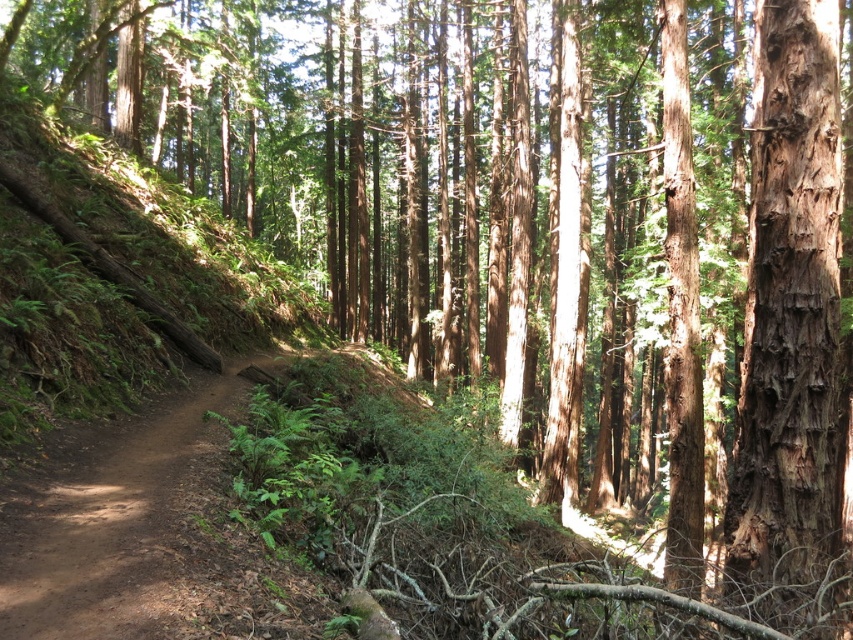
Question: In this image, where is rough bark tree trunk at right located relative to brown dirt track at center?

Choices:
 (A) above
 (B) below

Answer: (A)

Question: Which object is closer to the camera taking this photo?

Choices:
 (A) rough bark tree trunk at right
 (B) brown dirt track at center

Answer: (A)

Question: Is rough bark tree trunk at right thinner than brown dirt track at center?

Choices:
 (A) no
 (B) yes

Answer: (A)

Question: Is rough bark tree trunk at right to the right of brown dirt track at center from the viewer's perspective?

Choices:
 (A) no
 (B) yes

Answer: (B)